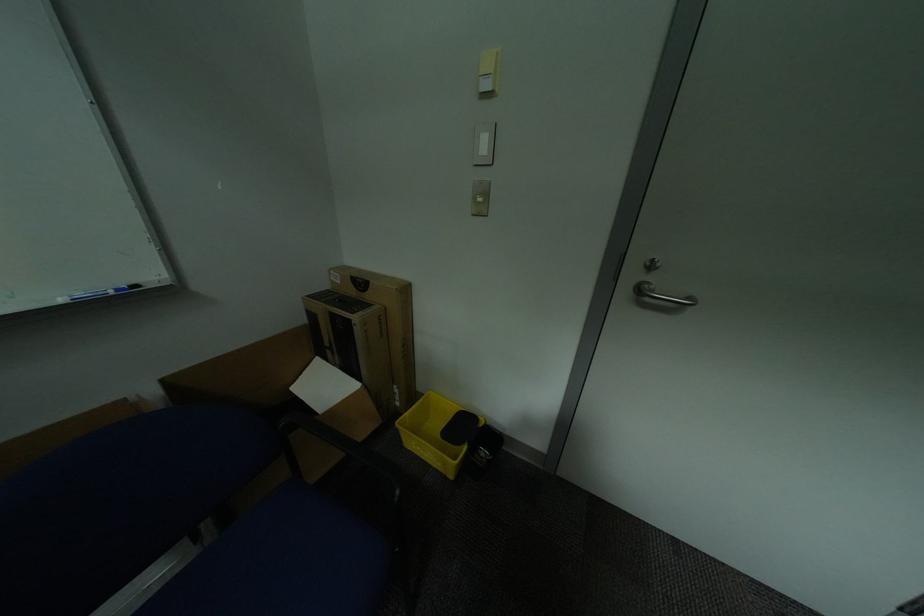
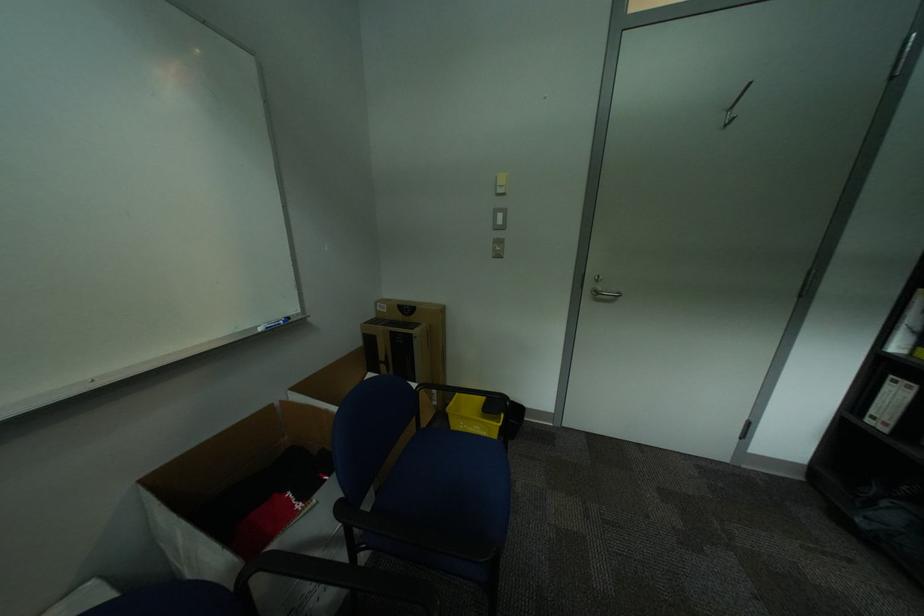
Where in the second image is the point corresponding to [418,415] from the first image?

(463, 405)